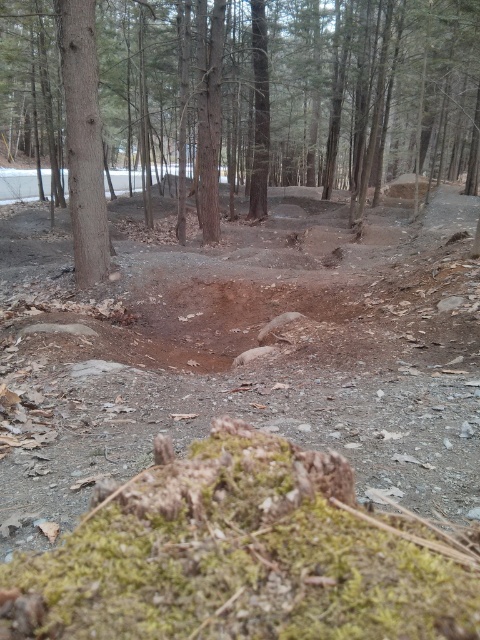
You are a hiker who wants to take a photo of the brown dirt track at center and the brown rough tree trunk at left. Which object should you focus on first to ensure both are in the frame?

You should focus on the brown dirt track at center first because it is closer to the viewer than the brown rough tree trunk at left, so adjusting focus starting from the closer object will help capture both in the frame.